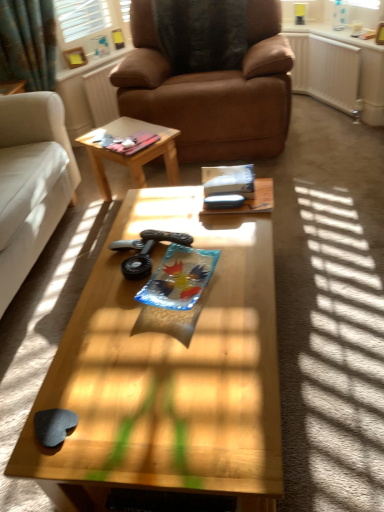
Where is `free space in front of black plastic game controller at center`? Image resolution: width=384 pixels, height=512 pixels. free space in front of black plastic game controller at center is located at coordinates (130, 310).